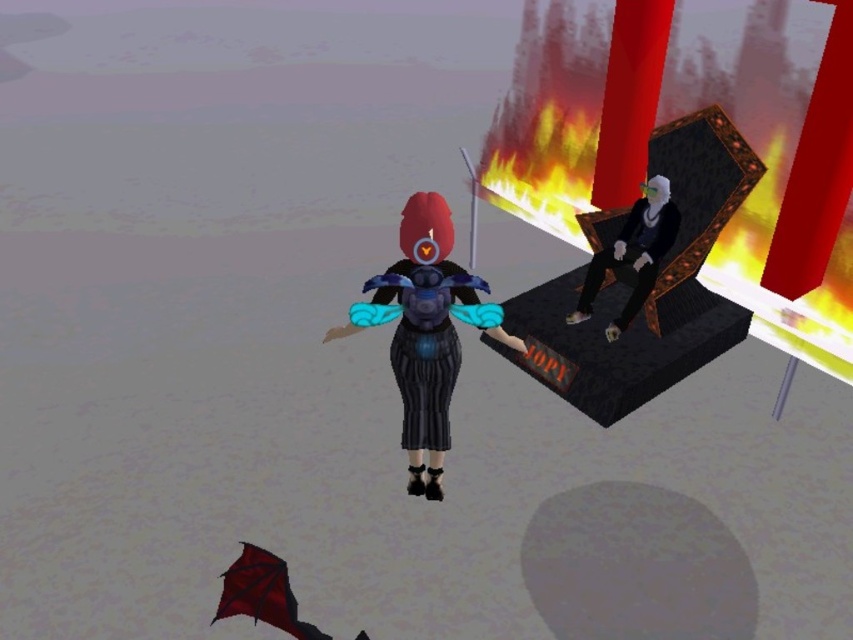
Question: Is shiny blue dress at center below smooth black chair at right?

Choices:
 (A) yes
 (B) no

Answer: (A)

Question: Which of the following is the closest to the observer?

Choices:
 (A) (422, 344)
 (B) (596, 264)

Answer: (A)

Question: Can you confirm if shiny blue dress at center is wider than smooth black chair at right?

Choices:
 (A) yes
 (B) no

Answer: (A)

Question: Is shiny blue dress at center closer to camera compared to smooth black chair at right?

Choices:
 (A) no
 (B) yes

Answer: (B)

Question: Which point is farther to the camera?

Choices:
 (A) (461, 273)
 (B) (634, 228)

Answer: (B)